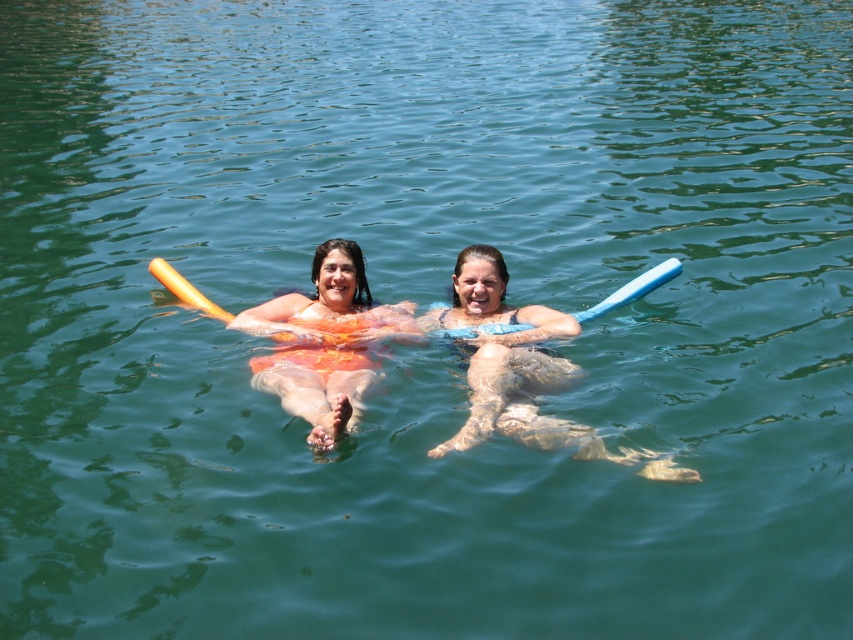
Question: Which point is closer to the camera?

Choices:
 (A) (479, 380)
 (B) (517, 326)
 (C) (344, 262)

Answer: (A)

Question: Does blue rubber float at center have a lesser width compared to orange foam paddle at center?

Choices:
 (A) yes
 (B) no

Answer: (B)

Question: Observing the image, what is the correct spatial positioning of orange fabric at center in reference to blue foam paddle at center?

Choices:
 (A) right
 (B) left

Answer: (B)

Question: Which of these objects is positioned farthest from the blue foam paddle at center?

Choices:
 (A) orange foam paddle at center
 (B) blue rubber float at center
 (C) orange fabric at center

Answer: (C)

Question: Is blue rubber float at center wider than orange foam paddle at center?

Choices:
 (A) yes
 (B) no

Answer: (A)

Question: Considering the real-world distances, which object is farthest from the blue foam paddle at center?

Choices:
 (A) orange fabric at center
 (B) blue rubber float at center
 (C) orange foam paddle at center

Answer: (A)